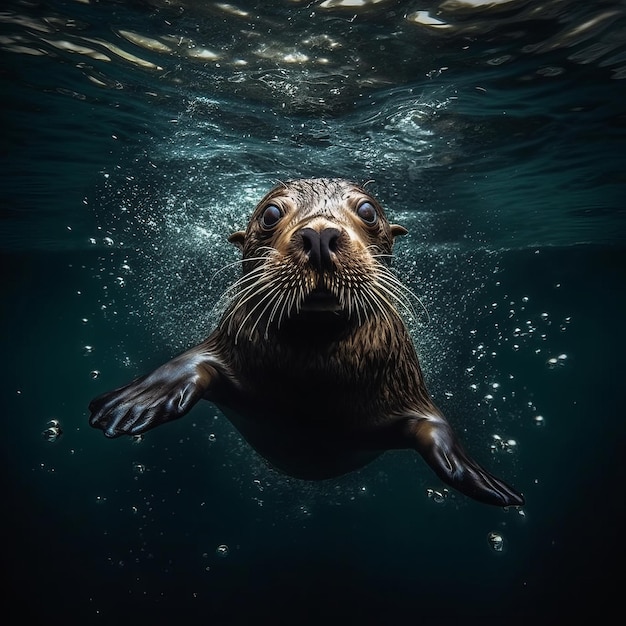
Find the location of a particular element. This screenshot has width=626, height=626. chest is located at coordinates (319, 359).